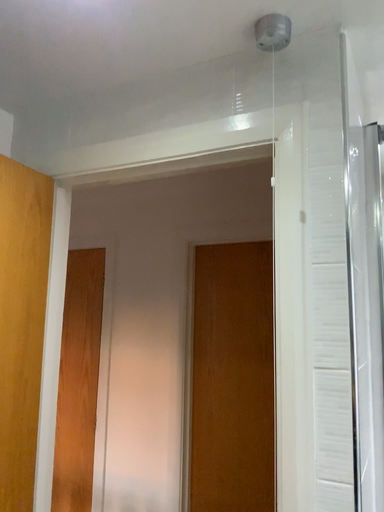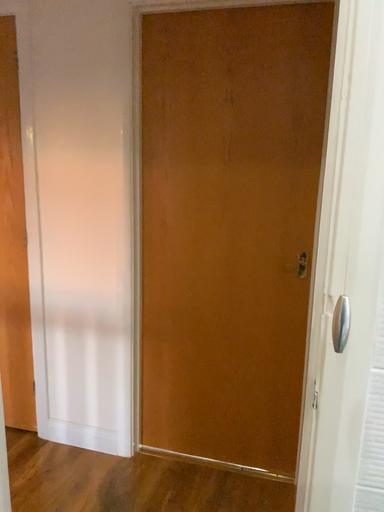
Question: How did the camera likely rotate when shooting the video?

Choices:
 (A) rotated upward
 (B) rotated downward

Answer: (B)